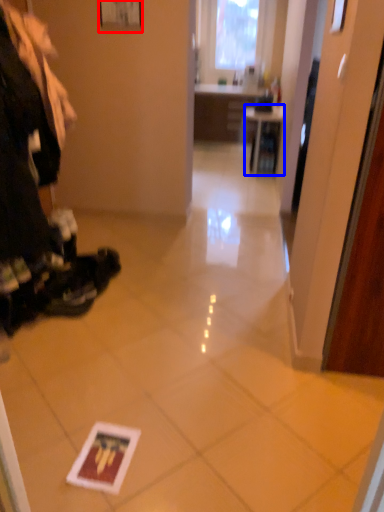
Question: Which point is closer to the camera, picture frame (highlighted by a red box) or table (highlighted by a blue box)?

Choices:
 (A) picture frame
 (B) table

Answer: (A)